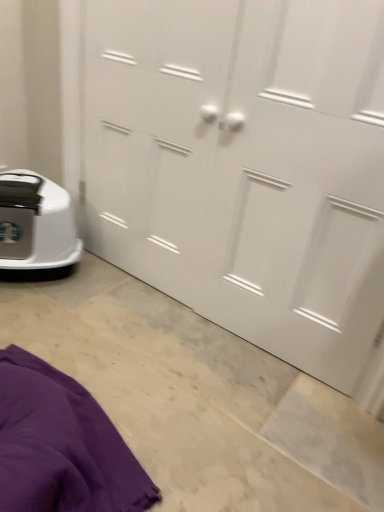
Question: Is white matte door at center positioned before purple fabric at lower left?

Choices:
 (A) no
 (B) yes

Answer: (A)

Question: From the image's perspective, is white matte door at center located beneath purple fabric at lower left?

Choices:
 (A) yes
 (B) no

Answer: (B)

Question: Is white matte door at center located outside purple fabric at lower left?

Choices:
 (A) no
 (B) yes

Answer: (B)

Question: Considering the relative sizes of white matte door at center and purple fabric at lower left in the image provided, is white matte door at center shorter than purple fabric at lower left?

Choices:
 (A) yes
 (B) no

Answer: (B)

Question: Considering the relative sizes of white matte door at center and purple fabric at lower left in the image provided, is white matte door at center wider than purple fabric at lower left?

Choices:
 (A) yes
 (B) no

Answer: (B)

Question: From the image's perspective, relative to purple fabric at lower left, is white matte door at center above or below?

Choices:
 (A) below
 (B) above

Answer: (B)

Question: Considering the positions of white matte door at center and purple fabric at lower left in the image, is white matte door at center wider or thinner than purple fabric at lower left?

Choices:
 (A) wide
 (B) thin

Answer: (B)

Question: Is white matte door at center to the left or to the right of purple fabric at lower left in the image?

Choices:
 (A) right
 (B) left

Answer: (A)

Question: Considering their positions, is white matte door at center located in front of or behind purple fabric at lower left?

Choices:
 (A) front
 (B) behind

Answer: (B)

Question: Is purple fabric at lower left bigger or smaller than white plastic robot vacuum at lower left?

Choices:
 (A) small
 (B) big

Answer: (B)

Question: Considering their positions, is purple fabric at lower left located in front of or behind white plastic robot vacuum at lower left?

Choices:
 (A) front
 (B) behind

Answer: (A)

Question: Is purple fabric at lower left spatially inside white plastic robot vacuum at lower left, or outside of it?

Choices:
 (A) outside
 (B) inside

Answer: (A)

Question: Considering the positions of point (140, 507) and point (64, 243), is point (140, 507) closer or farther from the camera than point (64, 243)?

Choices:
 (A) farther
 (B) closer

Answer: (B)

Question: Looking at the image, does white plastic robot vacuum at lower left seem bigger or smaller compared to purple fabric at lower left?

Choices:
 (A) small
 (B) big

Answer: (A)

Question: Visually, is white plastic robot vacuum at lower left positioned to the left or to the right of purple fabric at lower left?

Choices:
 (A) right
 (B) left

Answer: (B)